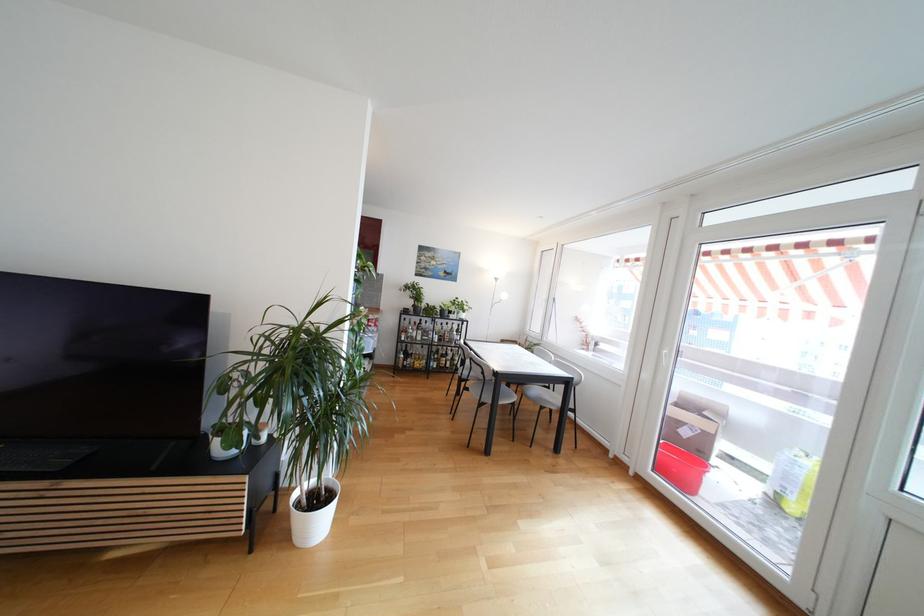
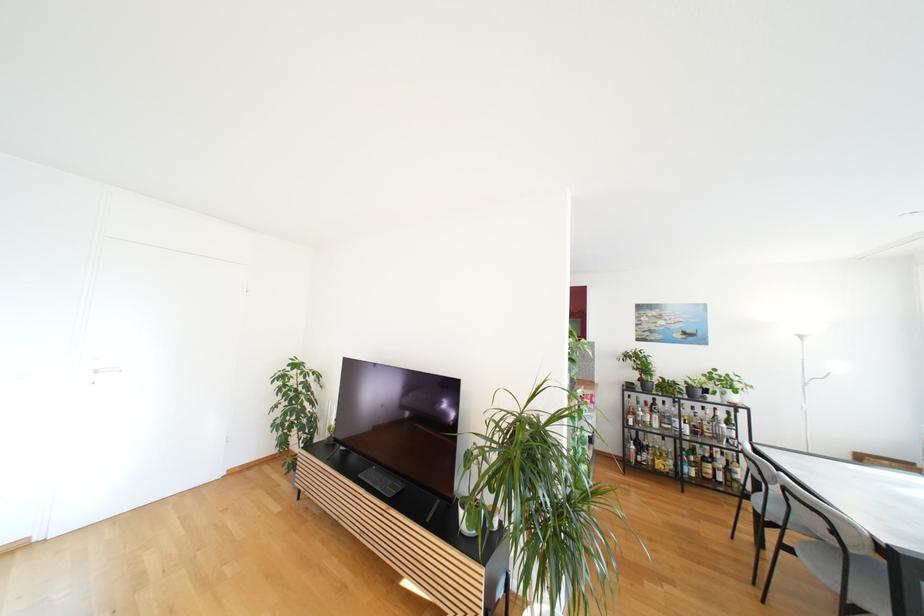
Question: The camera is either moving clockwise (left) or counter-clockwise (right) around the object. The first image is from the beginning of the video and the second image is from the end. Is the camera moving left or right when shooting the video?

Choices:
 (A) Left
 (B) Right

Answer: (B)